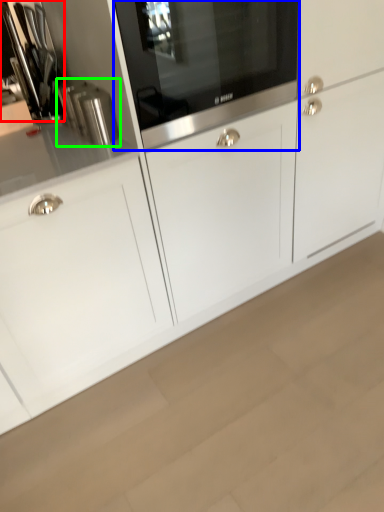
Question: Considering the real-world distances, which object is farthest from appliance (highlighted by a red box)? home appliance (highlighted by a blue box) or kitchen appliance (highlighted by a green box)?

Choices:
 (A) home appliance
 (B) kitchen appliance

Answer: (A)